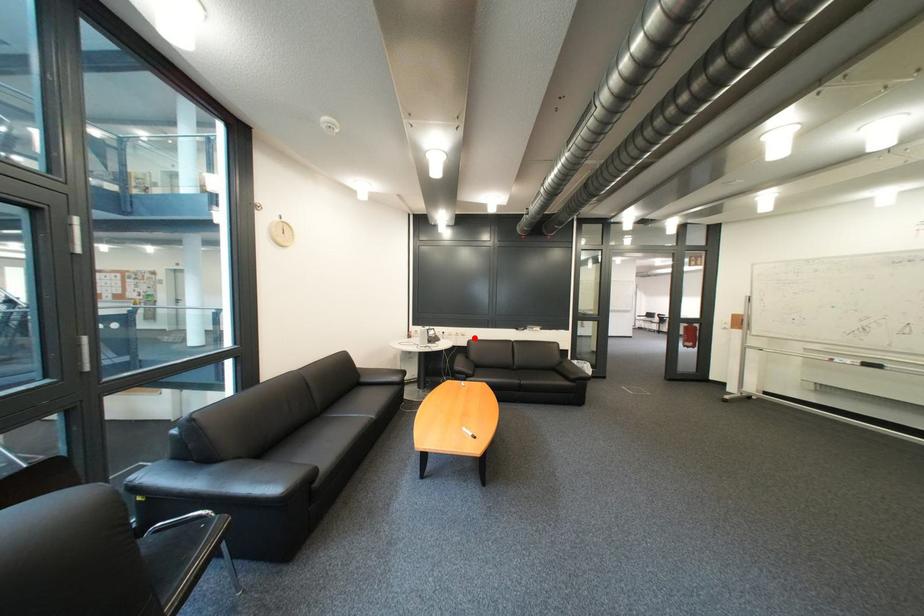
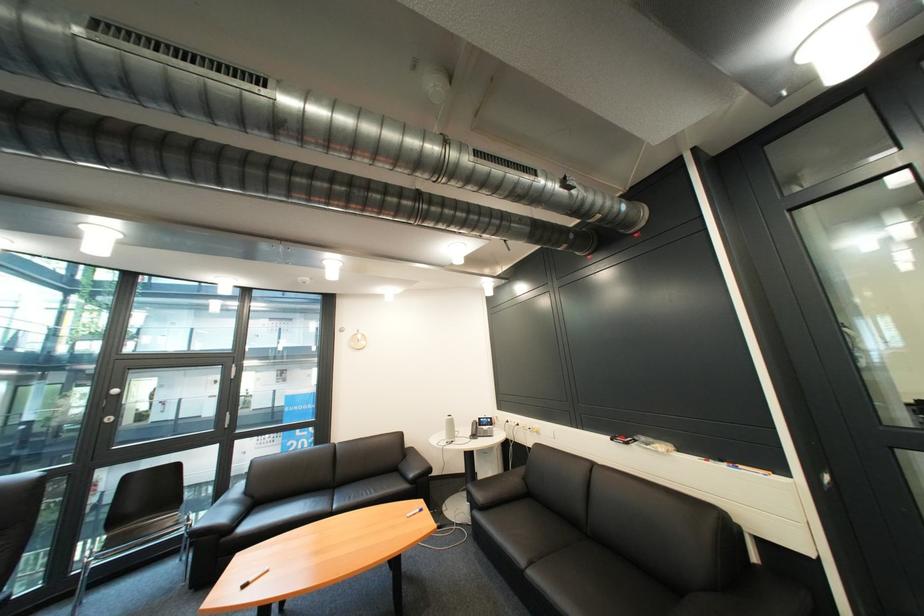
The point at the highlighted location is marked in the first image. Where is the corresponding point in the second image?

(549, 435)